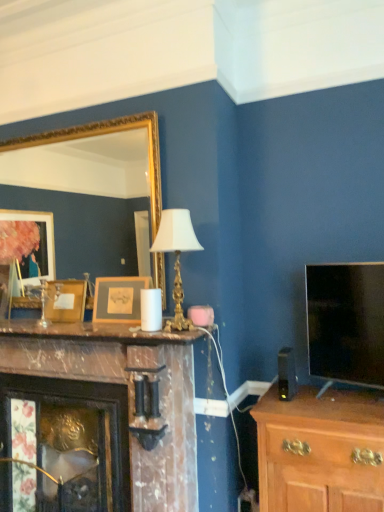
Where is `free region under flat-screen tv at right (from a real-world perspective)`? free region under flat-screen tv at right (from a real-world perspective) is located at coordinates (351, 399).